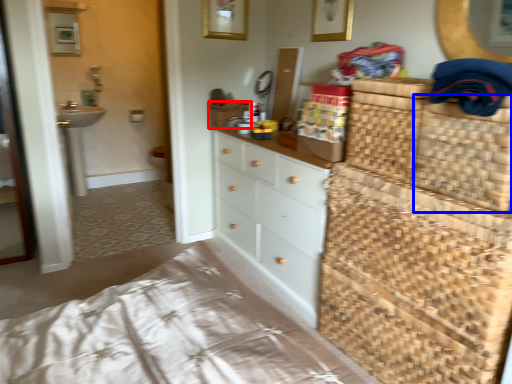
Question: Which of the following is the farthest to the observer, basket (highlighted by a red box) or basket (highlighted by a blue box)?

Choices:
 (A) basket
 (B) basket

Answer: (A)